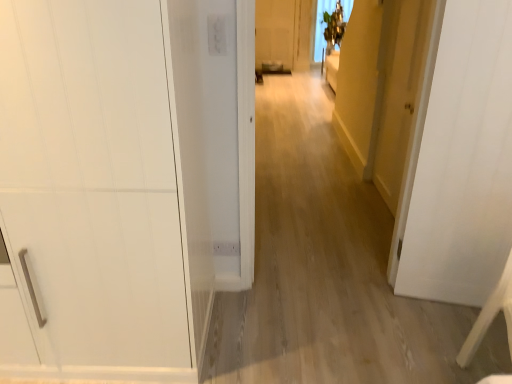
You are a GUI agent. You are given a task and a screenshot of the screen. Output one action in this format:
    pyautogui.click(x=<x>, y=<y>)
    Task: Click on the free space to the left of white matte door at center, the second door viewed from the right
    The height and width of the screenshot is (384, 512).
    Given the screenshot: What is the action you would take?
    pyautogui.click(x=384, y=307)